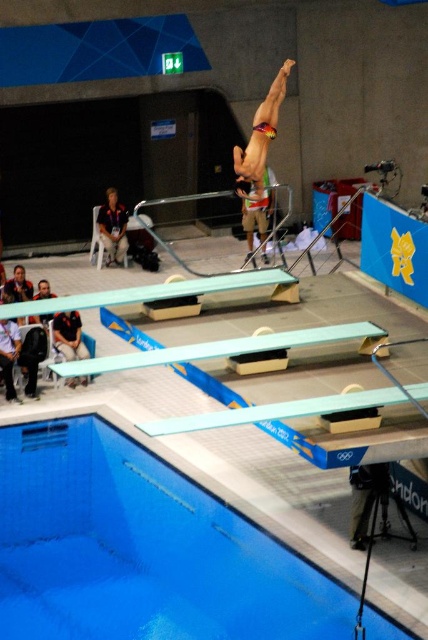
You are standing at the edge of the pool watching the diver perform. You notice a light brown leather jacket at lower left. If you want to retrieve it without leaving your spot, can you reach it? Explain why or why not.

The light brown leather jacket at lower left is 15.87 meters away from you. Since this distance is too far to reach without moving, you cannot retrieve it while staying at your current position.

Looking at this image, you are a spectator at the London 2012 Olympics watching the diving competition. You notice the blue smooth water at lower left and the matte yellow swimsuit at center. Which object is higher from the ground?

The blue smooth water at lower left has a greater height compared to the matte yellow swimsuit at center, so the blue smooth water at lower left is higher from the ground.

You are a photographer at the London 2012 Olympics trying to capture the diver midair. You notice the blue smooth water at lower left and the dark gray fabric jacket at lower left in your frame. Which object will you focus on to ensure the subject is centered in your shot?

The blue smooth water at lower left has a larger width than the dark gray fabric jacket at lower left, so focusing on the blue smooth water at lower left would help center the subject as it occupies more space in the frame.